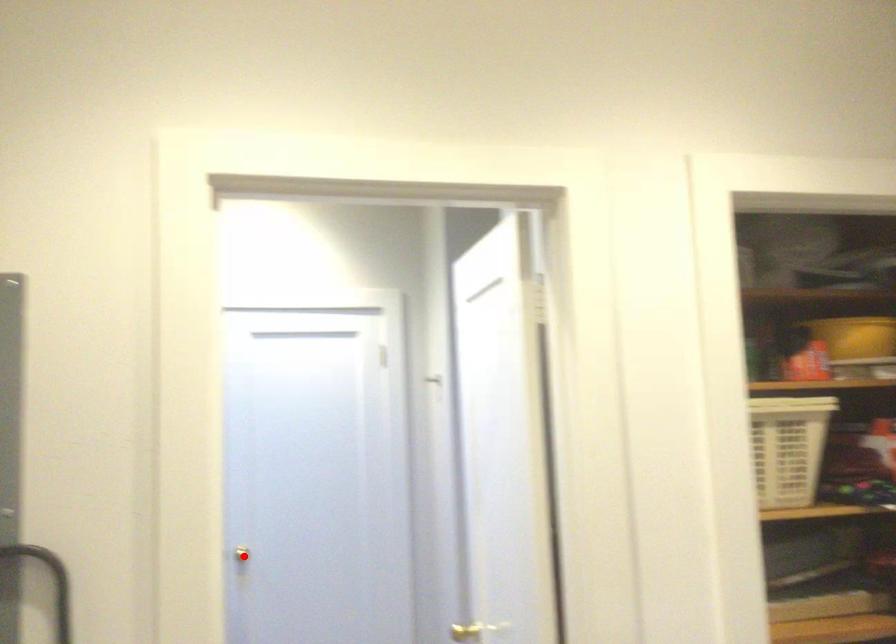
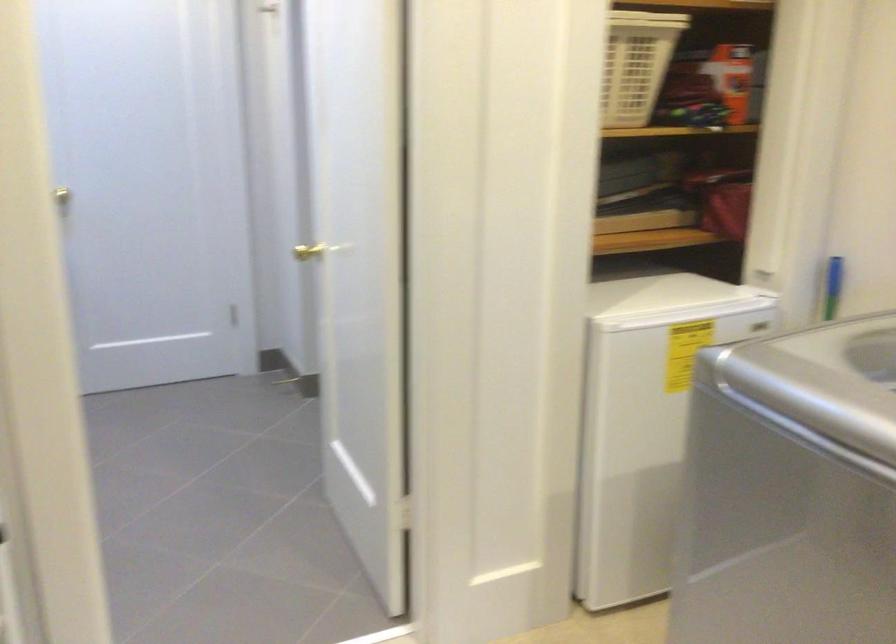
Find the pixel in the second image that matches the highlighted location in the first image.

(71, 192)